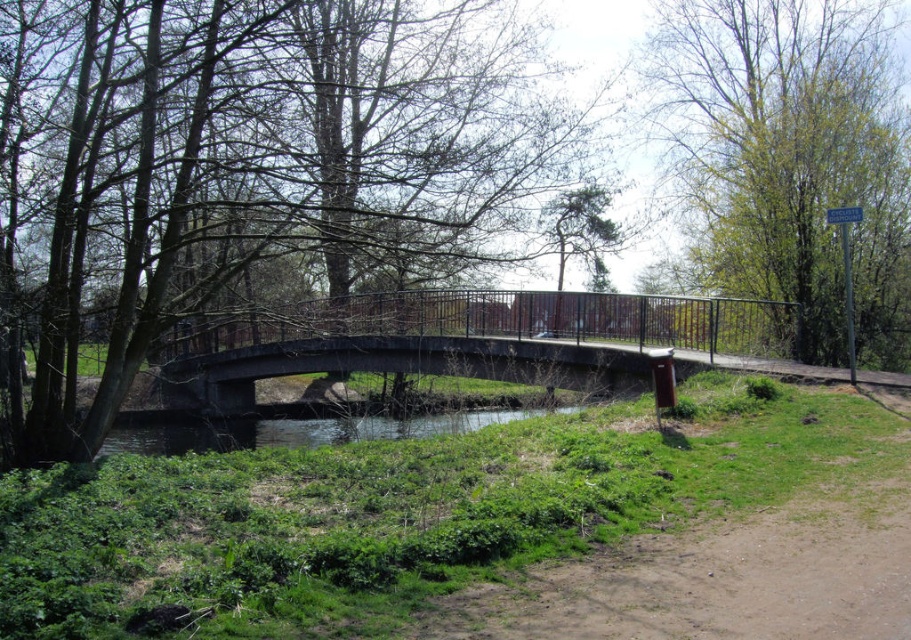
Can you confirm if brown wood tree at center is positioned to the left of concrete bridge at center?

Indeed, brown wood tree at center is positioned on the left side of concrete bridge at center.

Who is more distant from viewer, (0, 61) or (280, 483)?

The point (0, 61) is behind.

Find the location of a particular element. The image size is (911, 640). brown wood tree at center is located at coordinates (254, 166).

Is concrete bridge at center positioned at the back of clear water at center?

No.

Is concrete bridge at center in front of clear water at center?

Yes.

Who is more forward, (544, 484) or (251, 445)?

Point (544, 484)

Locate an element on the screen. The width and height of the screenshot is (911, 640). concrete bridge at center is located at coordinates (392, 513).

Measure the distance from concrete bridge at center to green leafy tree at upper right.

A distance of 11.30 meters exists between concrete bridge at center and green leafy tree at upper right.

Is point (642, 417) closer to viewer compared to point (676, 193)?

That is True.

Identify the location of concrete bridge at center. (392, 513).